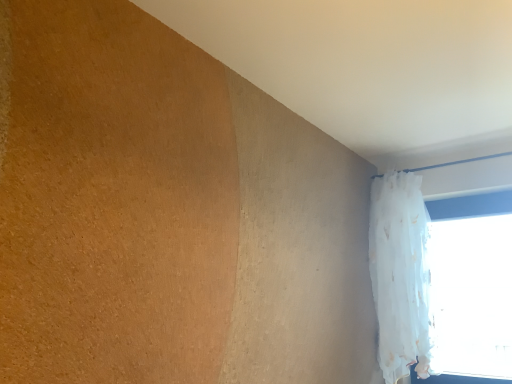
Question: From the image's perspective, is white sheer curtain at upper right beneath white sheer curtain at right?

Choices:
 (A) yes
 (B) no

Answer: (B)

Question: Is white sheer curtain at upper right next to white sheer curtain at right and touching it?

Choices:
 (A) no
 (B) yes

Answer: (A)

Question: Can you confirm if white sheer curtain at upper right is shorter than white sheer curtain at right?

Choices:
 (A) yes
 (B) no

Answer: (B)

Question: Is white sheer curtain at upper right looking in the opposite direction of white sheer curtain at right?

Choices:
 (A) yes
 (B) no

Answer: (A)

Question: Does white sheer curtain at upper right have a smaller size compared to white sheer curtain at right?

Choices:
 (A) yes
 (B) no

Answer: (B)

Question: Does white sheer curtain at upper right appear on the right side of white sheer curtain at right?

Choices:
 (A) no
 (B) yes

Answer: (A)

Question: From the image's perspective, is white sheer curtain at right under white sheer curtain at upper right?

Choices:
 (A) no
 (B) yes

Answer: (B)

Question: Can you confirm if white sheer curtain at right is shorter than white sheer curtain at upper right?

Choices:
 (A) yes
 (B) no

Answer: (A)

Question: Does white sheer curtain at right have a greater width compared to white sheer curtain at upper right?

Choices:
 (A) yes
 (B) no

Answer: (B)

Question: Considering the relative sizes of white sheer curtain at right and white sheer curtain at upper right in the image provided, is white sheer curtain at right taller than white sheer curtain at upper right?

Choices:
 (A) no
 (B) yes

Answer: (A)

Question: Is white sheer curtain at right with white sheer curtain at upper right?

Choices:
 (A) no
 (B) yes

Answer: (A)

Question: Is white sheer curtain at right not close to white sheer curtain at upper right?

Choices:
 (A) yes
 (B) no

Answer: (B)

Question: Is point (399, 322) positioned closer to the camera than point (440, 352)?

Choices:
 (A) closer
 (B) farther

Answer: (A)